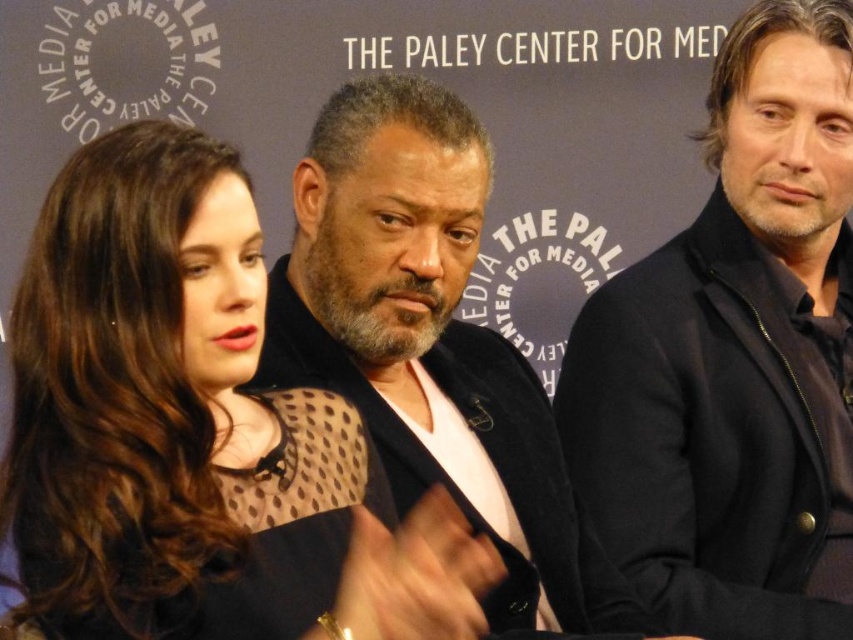
Question: Which of the following is the farthest from the observer?

Choices:
 (A) (735, 419)
 (B) (292, 515)
 (C) (608, 636)

Answer: (A)

Question: Estimate the real-world distances between objects in this image. Which object is farther from the matte black dress at center?

Choices:
 (A) black matte suit at center
 (B) black wool jacket at right

Answer: (B)

Question: Can you confirm if matte black dress at center is smaller than black wool jacket at right?

Choices:
 (A) no
 (B) yes

Answer: (B)

Question: Among these points, which one is farthest from the camera?

Choices:
 (A) (509, 464)
 (B) (669, 572)
 (C) (465, 563)

Answer: (A)

Question: Is matte black dress at center behind black wool jacket at right?

Choices:
 (A) no
 (B) yes

Answer: (A)

Question: Does matte black dress at center come behind black matte suit at center?

Choices:
 (A) no
 (B) yes

Answer: (A)